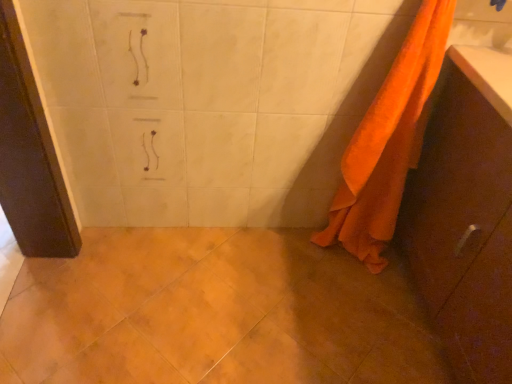
Question: In terms of height, does orange fabric cabinet at right look taller or shorter compared to orange fabric towel at right?

Choices:
 (A) tall
 (B) short

Answer: (B)

Question: From the image's perspective, is orange fabric cabinet at right above or below orange fabric towel at right?

Choices:
 (A) above
 (B) below

Answer: (B)

Question: From a real-world perspective, is orange fabric cabinet at right physically located above or below orange fabric towel at right?

Choices:
 (A) above
 (B) below

Answer: (B)

Question: Is orange fabric towel at right taller or shorter than orange fabric cabinet at right?

Choices:
 (A) tall
 (B) short

Answer: (A)

Question: Considering the positions of orange fabric towel at right and orange fabric cabinet at right in the image, is orange fabric towel at right bigger or smaller than orange fabric cabinet at right?

Choices:
 (A) small
 (B) big

Answer: (A)

Question: From the image's perspective, is orange fabric towel at right positioned above or below orange fabric cabinet at right?

Choices:
 (A) below
 (B) above

Answer: (B)

Question: Is orange fabric towel at right inside the boundaries of orange fabric cabinet at right, or outside?

Choices:
 (A) inside
 (B) outside

Answer: (B)